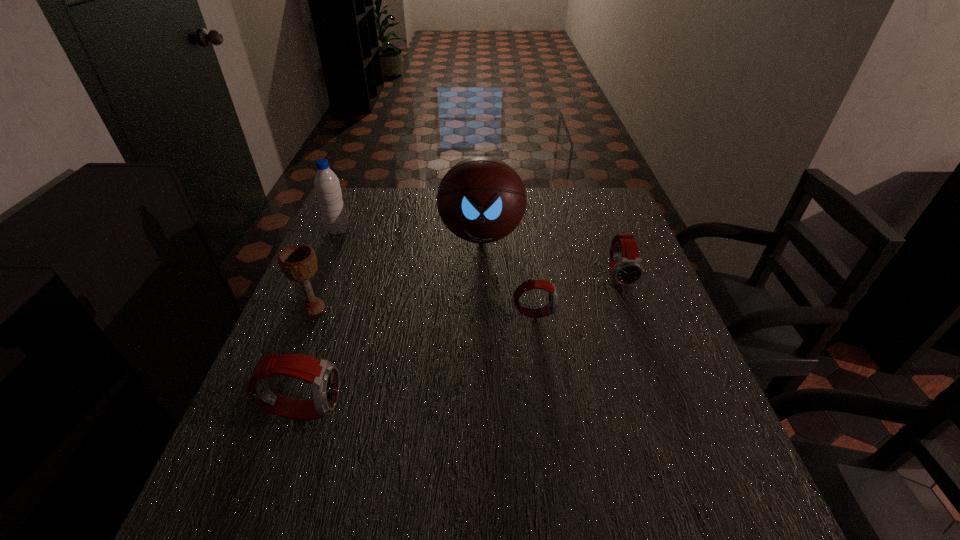
This screenshot has height=540, width=960. I want to click on the closest watch to the second shortest watch, so click(552, 305).

Where is `watch that stands as the closest to the second watch from left to right`? watch that stands as the closest to the second watch from left to right is located at coordinates (626, 268).

Find the location of a particular element. Image resolution: width=960 pixels, height=540 pixels. vacant region that satisfies the following two spatial constraints: 1. on the face of the fourth nearest object; 2. on the face of the shortest watch is located at coordinates (632, 313).

The image size is (960, 540). In order to click on free spot that satisfies the following two spatial constraints: 1. on the face of the second tallest watch; 2. on the face of the second farthest watch in this screenshot , I will do `click(632, 313)`.

This screenshot has width=960, height=540. I want to click on vacant region that satisfies the following two spatial constraints: 1. on the face of the third farthest object; 2. on the face of the shortest watch, so click(x=632, y=313).

Locate an element on the screen. Image resolution: width=960 pixels, height=540 pixels. vacant position in the image that satisfies the following two spatial constraints: 1. on the face of the rightmost object; 2. on the face of the nearest watch is located at coordinates (666, 409).